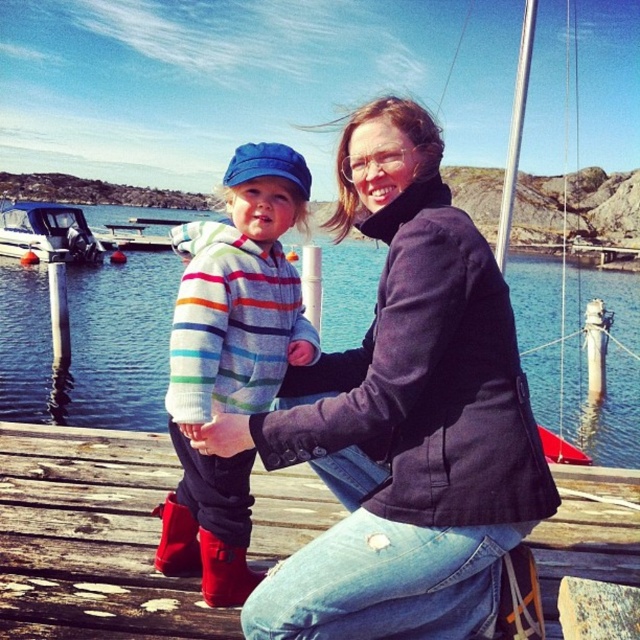
You are a photographer standing on the wooden dock and want to take a photo of the red suede boot at lower left. You need to position yourself exactly 1.61 meters away from the boot to get the perfect shot. Can you do that by standing on the wooden at lower left?

Yes, the wooden at lower left is 1.61 meters from the red suede boot at lower left, so standing on the wooden at lower left will place you exactly at the required distance of 1.61 meters from the boot.

You are standing on the wooden dock and want to know which object is shorter between the wooden at lower left and the blue water at dock center. Can you tell me?

The wooden at lower left is not as tall as the blue water at dock center, so the wooden at lower left is shorter.